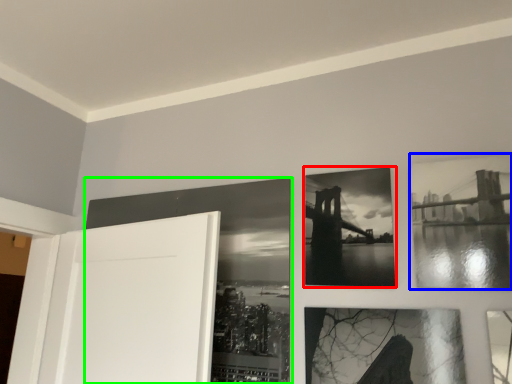
Question: Estimate the real-world distances between objects in this image. Which object is closer to picture frame (highlighted by a red box), picture frame (highlighted by a blue box) or picture frame (highlighted by a green box)?

Choices:
 (A) picture frame
 (B) picture frame

Answer: (A)